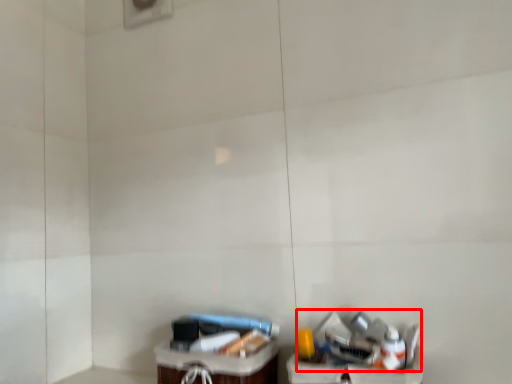
Question: Observing the image, what is the correct spatial positioning of garbage (annotated by the red box) in reference to furniture?

Choices:
 (A) right
 (B) left

Answer: (A)